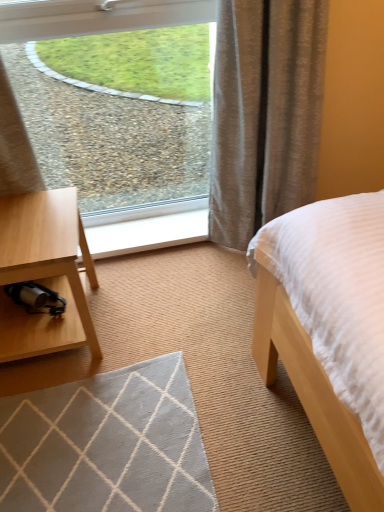
What do you see at coordinates (150, 231) in the screenshot? The image size is (384, 512). I see `white wood at center` at bounding box center [150, 231].

Locate an element on the screen. The width and height of the screenshot is (384, 512). textured beige curtain at upper right is located at coordinates (265, 113).

From a real-world perspective, which is physically below, clear glass window at upper left or white wood at center?

white wood at center, from a real-world perspective.

In the scene shown: Choose the correct answer: Is clear glass window at upper left inside white wood at center or outside it?

The correct answer is: outside.

Could you tell me if clear glass window at upper left is turned towards white wood at center?

Yes, clear glass window at upper left is facing white wood at center.

Is textured beige curtain at upper right taller than clear glass window at upper left?

Yes, textured beige curtain at upper right is taller than clear glass window at upper left.

Is textured beige curtain at upper right with clear glass window at upper left?

Yes, the surface of textured beige curtain at upper right is in contact with clear glass window at upper left.

In terms of size, does textured beige curtain at upper right appear bigger or smaller than clear glass window at upper left?

In the image, textured beige curtain at upper right appears to be larger than clear glass window at upper left.

In the scene shown: Is textured beige curtain at upper right turned away from clear glass window at upper left?

No, textured beige curtain at upper right's orientation is not away from clear glass window at upper left.

Is white wood at center positioned with its back to clear glass window at upper left?

white wood at center does not have its back to clear glass window at upper left.

Looking at this image, which point is more distant from viewer, (196,236) or (246,237)?

The point (196,236) is farther from the camera.

Is white wood at center not near clear glass window at upper left?

white wood at center is near clear glass window at upper left, not far away.

This screenshot has height=512, width=384. I want to click on window lying on the left of white wood at center, so click(96, 17).

Consider the image. In terms of width, does white wood at center look wider or thinner when compared to textured beige curtain at upper right?

Clearly, white wood at center has less width compared to textured beige curtain at upper right.

From the image's perspective, relative to textured beige curtain at upper right, is white wood at center above or below?

From the image's perspective, white wood at center appears below textured beige curtain at upper right.

Is white wood at center far away from textured beige curtain at upper right?

white wood at center is near textured beige curtain at upper right, not far away.

Between white wood at center and textured beige curtain at upper right, which one has smaller size?

Smaller between the two is white wood at center.

From the image's perspective, between clear glass window at upper left and textured beige curtain at upper right, who is located below?

textured beige curtain at upper right, from the image's perspective.

Is clear glass window at upper left in front of textured beige curtain at upper right?

No, the depth of clear glass window at upper left is greater than that of textured beige curtain at upper right.

Locate an element on the screen. The height and width of the screenshot is (512, 384). window on the left of the textured beige curtain at upper right is located at coordinates (96, 17).

Which object is positioned more to the left, clear glass window at upper left or textured beige curtain at upper right?

From the viewer's perspective, clear glass window at upper left appears more on the left side.

From their relative heights in the image, would you say textured beige curtain at upper right is taller or shorter than white wood at center?

textured beige curtain at upper right is taller than white wood at center.

Between textured beige curtain at upper right and white wood at center, which one appears on the right side from the viewer's perspective?

textured beige curtain at upper right is more to the right.

Does textured beige curtain at upper right come behind white wood at center?

No.

Identify the location of window sill that is behind the clear glass window at upper left. (150, 231).

Find the location of a particular element. curtain on the right of clear glass window at upper left is located at coordinates (265, 113).

Considering their positions, is clear glass window at upper left positioned closer to white wood at center than textured beige curtain at upper right?

clear glass window at upper left is positioned closer to the anchor white wood at center.

Estimate the real-world distances between objects in this image. Which object is closer to white wood at center, textured beige curtain at upper right or clear glass window at upper left?

clear glass window at upper left is closer to white wood at center.

When comparing their distances from clear glass window at upper left, does textured beige curtain at upper right or white wood at center seem closer?

The object closer to clear glass window at upper left is textured beige curtain at upper right.

From the image, which object appears to be farther from textured beige curtain at upper right, clear glass window at upper left or white wood at center?

white wood at center is positioned further to the anchor textured beige curtain at upper right.

From the image, which object appears to be nearer to clear glass window at upper left, white wood at center or textured beige curtain at upper right?

The object closer to clear glass window at upper left is textured beige curtain at upper right.

Considering their positions, is white wood at center positioned further to textured beige curtain at upper right than clear glass window at upper left?

white wood at center.

The width and height of the screenshot is (384, 512). I want to click on window between textured beige curtain at upper right and white wood at center from front to back, so click(96, 17).